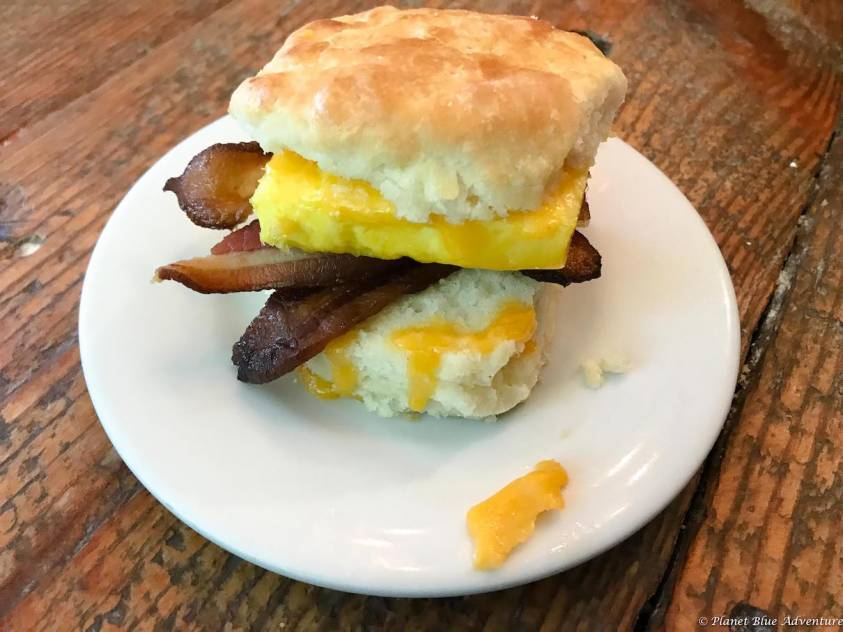
Locate an element on the screen. Image resolution: width=843 pixels, height=632 pixels. wood grain table is located at coordinates (105, 550).